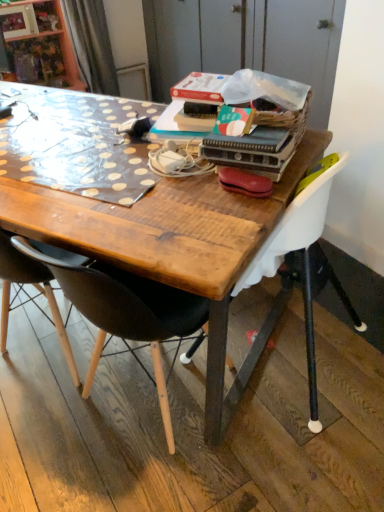
The image size is (384, 512). I want to click on empty space that is ontop of wooden desk at center, so click(88, 140).